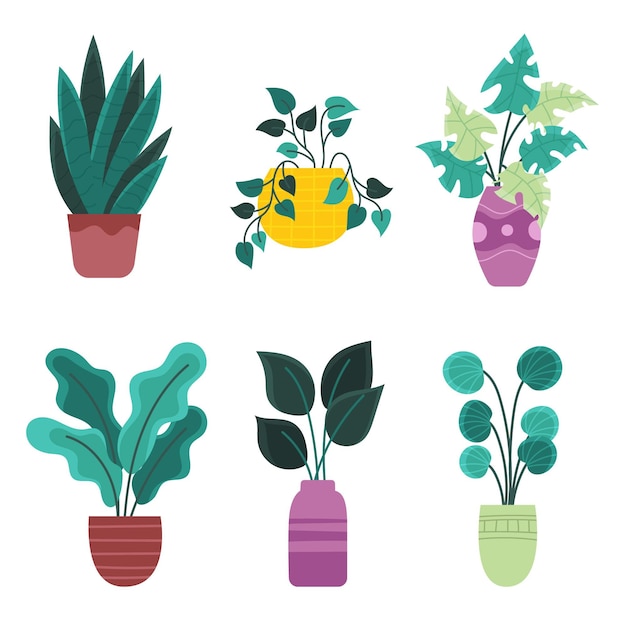
Find the location of a particular element. greenish vase is located at coordinates (506, 560).